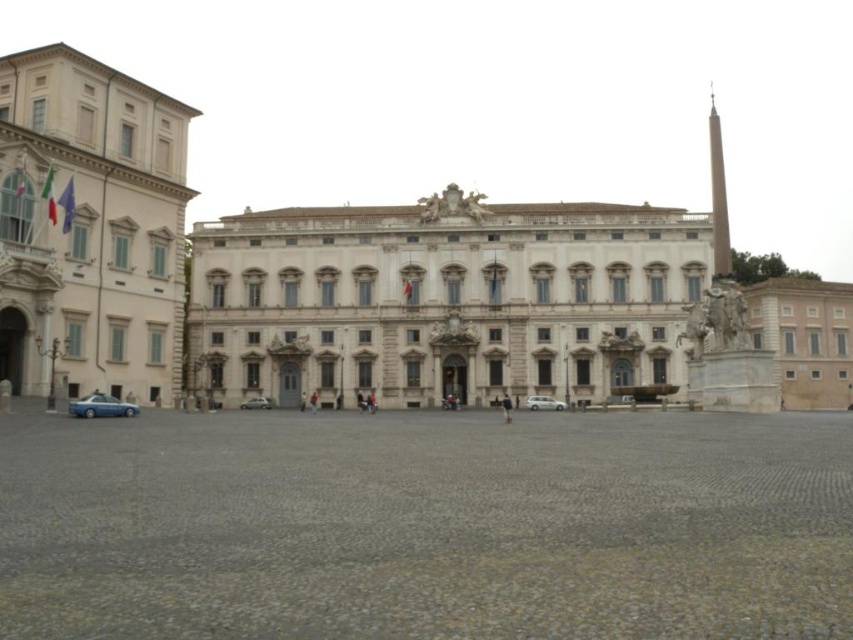
You are a photographer standing in the piazza and want to capture the white marble palace at center in your shot. The camera you have can focus on subjects up to 100 meters away. Will the palace be in focus?

The white marble palace at center is 99.75 meters away from the camera. Since the camera can focus up to 100 meters, the palace will be in focus.

You are a parking attendant who needs to fit both the blue metallic car at lower left and the white matte car at center into a parking spot that is 2 meters wide. Based on their widths, which car is more likely to fit into the spot without needing adjustments?

The white matte car at center is more likely to fit into the 2 meter wide parking spot without adjustments since the blue metallic car at lower left might be wider than the white matte car at center according to the description.

You are standing in the piazza in front of the grand historical building. You see a point at coordinate (102, 406). What object is located at that point?

The point at coordinate (102, 406) is on the blue metallic car at lower left.